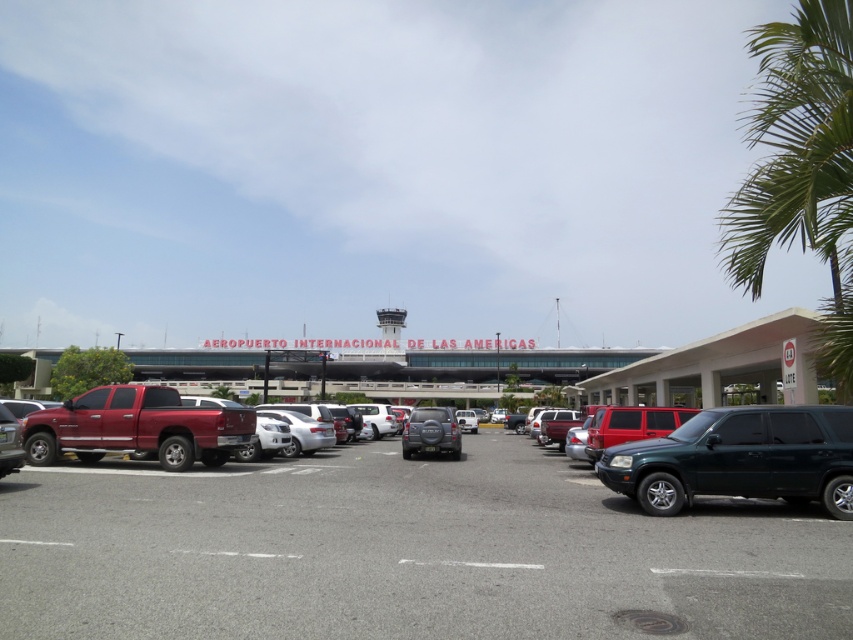
Who is more forward, (735, 442) or (19, 451)?

Point (735, 442) is in front.

Is point (759, 451) closer to camera compared to point (21, 454)?

Yes, it is in front of point (21, 454).

Who is more distant from viewer, [635,490] or [7,417]?

Positioned behind is point [7,417].

You are a GUI agent. You are given a task and a screenshot of the screen. Output one action in this format:
    pyautogui.click(x=<x>, y=<y>)
    Task: Click on the shiny black suv at right
    Image resolution: width=853 pixels, height=640 pixels.
    Given the screenshot: What is the action you would take?
    pyautogui.click(x=740, y=458)

Can you confirm if gray asphalt parking lot at center is smaller than shiny black suv at right?

Incorrect, gray asphalt parking lot at center is not smaller in size than shiny black suv at right.

Is gray asphalt parking lot at center further to camera compared to shiny black suv at right?

No.

Image resolution: width=853 pixels, height=640 pixels. I want to click on gray asphalt parking lot at center, so click(x=404, y=552).

Which of these two, green leafy palm tree at right or shiny black suv at right, stands taller?

Standing taller between the two is green leafy palm tree at right.

Can you confirm if green leafy palm tree at right is smaller than shiny black suv at right?

Incorrect, green leafy palm tree at right is not smaller in size than shiny black suv at right.

The width and height of the screenshot is (853, 640). Find the location of `green leafy palm tree at right`. green leafy palm tree at right is located at coordinates (799, 164).